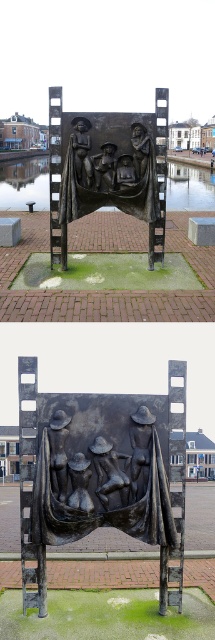
Question: Which of the following is the closest to the observer?

Choices:
 (A) (130, 173)
 (B) (99, 483)
 (C) (52, 454)

Answer: (B)

Question: Which is nearer to the bronze face at center?

Choices:
 (A) bronze figure at center
 (B) bronze textured figures at center

Answer: (A)

Question: Does bronze textured sculpture at center come behind bronze figure at center?

Choices:
 (A) yes
 (B) no

Answer: (B)

Question: Is bronze face at center to the left of bronze figure at center from the viewer's perspective?

Choices:
 (A) yes
 (B) no

Answer: (A)

Question: Is bronze textured sculpture at center smaller than bronze face at center?

Choices:
 (A) no
 (B) yes

Answer: (B)

Question: Which point is closer to the camera?

Choices:
 (A) bronze face at center
 (B) bronze textured figures at center
 (C) bronze figure at center
 (D) bronze textured sculpture at center

Answer: (B)